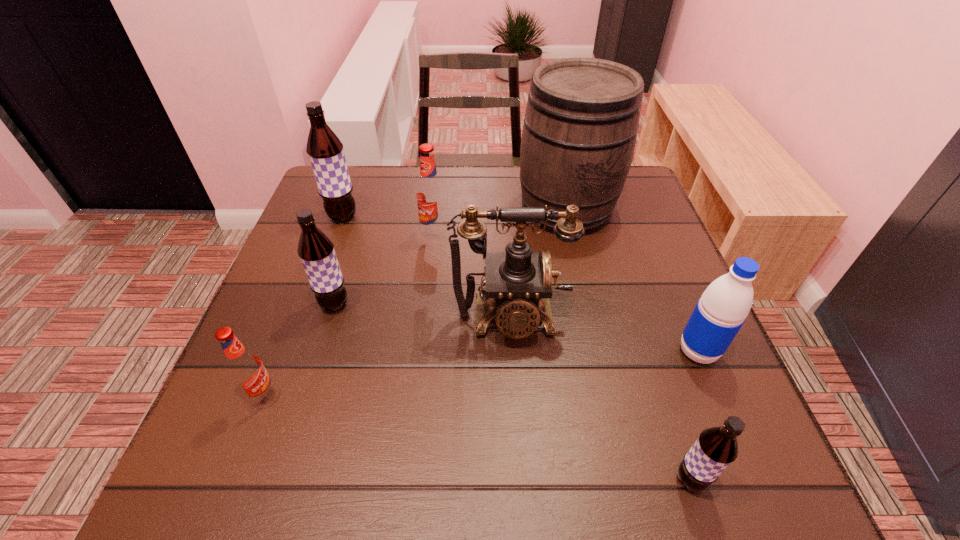
Image resolution: width=960 pixels, height=540 pixels. Identify the location of object that is at the near right corner. (716, 448).

Where is `blank space at the far edge of the desktop`? This screenshot has width=960, height=540. blank space at the far edge of the desktop is located at coordinates (454, 166).

In the image, there is a desktop. In order to click on vacant region at the near edge in this screenshot , I will do `click(498, 476)`.

This screenshot has height=540, width=960. I want to click on blank space at the left edge of the desktop, so click(x=316, y=398).

The height and width of the screenshot is (540, 960). Identify the location of free region at the right edge of the desktop. (620, 265).

Where is `vacant space at the near left corner`? vacant space at the near left corner is located at coordinates tap(269, 480).

What are the coordinates of `vacant space that is in between the telephone and the nearest root beer` in the screenshot? It's located at (x=600, y=399).

The height and width of the screenshot is (540, 960). Identify the location of free space between the fourth farthest root beer and the wine bucket. (415, 302).

Find the location of a particular element. The width and height of the screenshot is (960, 540). free point between the left red root beer and the telephone is located at coordinates (387, 357).

Locate an element on the screen. This screenshot has height=540, width=960. free space between the rightmost root beer and the blue water bottle is located at coordinates (694, 415).